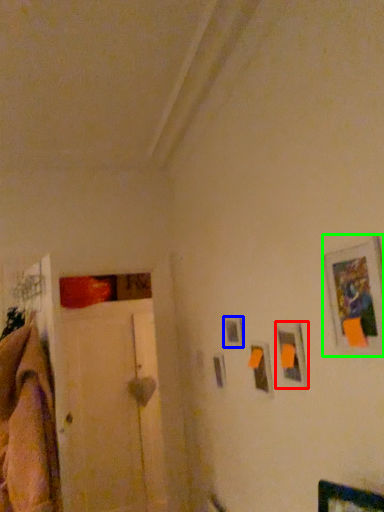
Question: Considering the real-world distances, which object is farthest from picture frame (highlighted by a red box)? picture frame (highlighted by a blue box) or picture frame (highlighted by a green box)?

Choices:
 (A) picture frame
 (B) picture frame

Answer: (A)